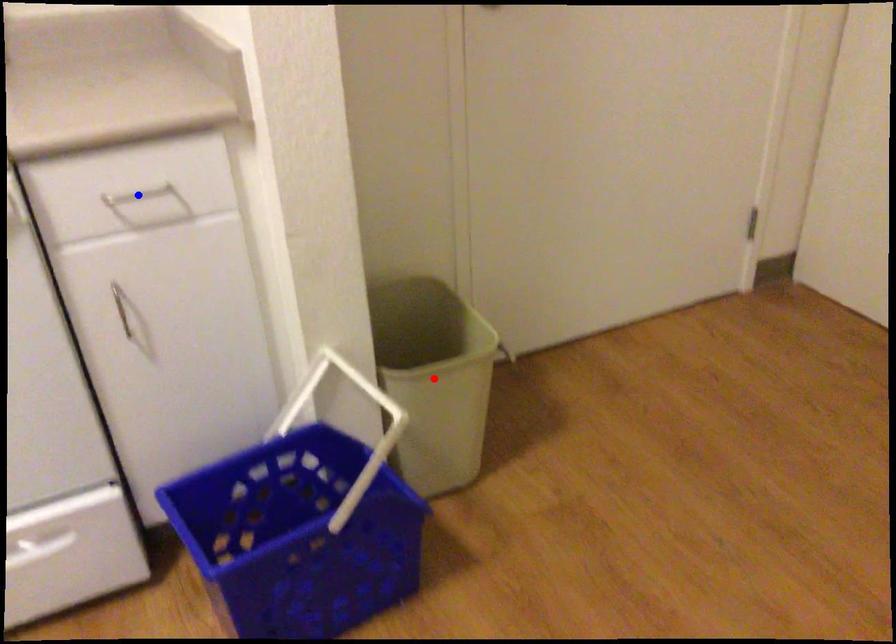
Question: In the image, two points are highlighted. Which point is nearer to the camera? Reply with the corresponding letter.

Choices:
 (A) blue point
 (B) red point

Answer: (A)